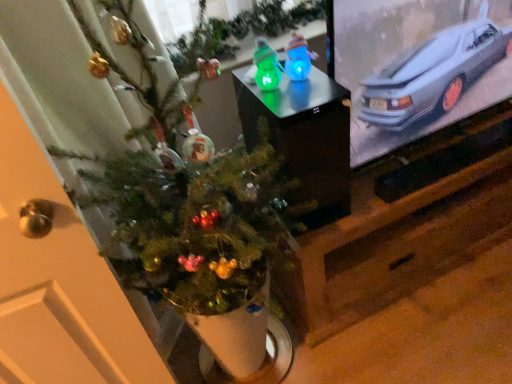
Question: Based on their positions, is green matte christmas tree at center located to the left or right of glossy plastic snowmen at center?

Choices:
 (A) right
 (B) left

Answer: (B)

Question: From the image's perspective, is green matte christmas tree at center positioned above or below glossy plastic snowmen at center?

Choices:
 (A) above
 (B) below

Answer: (B)

Question: Estimate the real-world distances between objects in this image. Which object is closer to the green translucent toy at center, marked as the second toy in a right-to-left arrangement?

Choices:
 (A) green matte christmas tree at center
 (B) glossy plastic snowmen at center
 (C) blue translucent snowman at center, placed as the 1th toy when sorted from right to left

Answer: (C)

Question: Which is farther from the green translucent toy at center, marked as the second toy in a right-to-left arrangement?

Choices:
 (A) green matte christmas tree at center
 (B) blue translucent snowman at center, placed as the 1th toy when sorted from right to left
 (C) glossy plastic snowmen at center

Answer: (A)